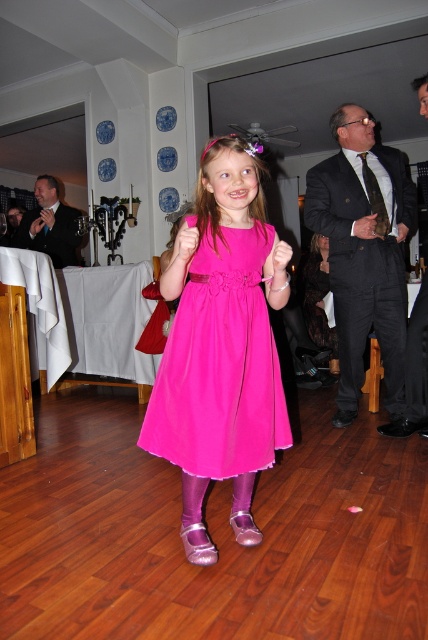
Who is lower down, fuchsia chiffon dress at center or black textured suit at upper right?

Positioned lower is fuchsia chiffon dress at center.

Who is shorter, fuchsia chiffon dress at center or black textured suit at upper right?

With less height is fuchsia chiffon dress at center.

Who is more distant from viewer, (193, 442) or (388, 189)?

The point (388, 189) is behind.

This screenshot has height=640, width=428. I want to click on fuchsia chiffon dress at center, so click(220, 365).